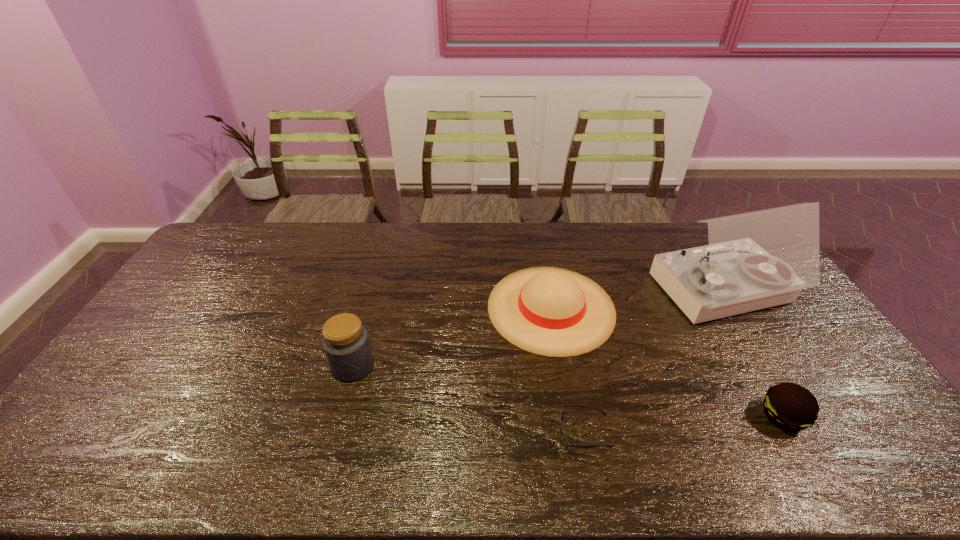
Identify the location of vacant space situated 0.060m on the front-facing side of the shortest object. (535, 431).

I want to click on vacant space situated 0.100m on the front-facing side of the shortest object, so click(518, 431).

Find the location of a particular element. The height and width of the screenshot is (540, 960). free space located 0.160m on the front-facing side of the shortest object is located at coordinates (494, 431).

At what (x,y) coordinates should I click in order to perform the action: click on object positioned at the far edge. Please return your answer as a coordinate pair (x, y). The width and height of the screenshot is (960, 540). Looking at the image, I should click on (760, 259).

Where is `object present at the near edge`? The height and width of the screenshot is (540, 960). object present at the near edge is located at coordinates (565, 442).

This screenshot has height=540, width=960. What are the coordinates of `object that is at the right edge` in the screenshot? It's located at (760, 259).

Where is `object that is at the far right corner`? object that is at the far right corner is located at coordinates (760, 259).

I want to click on free spot at the far edge of the desktop, so click(311, 258).

This screenshot has height=540, width=960. In the image, there is a desktop. In order to click on free space at the near edge in this screenshot , I will do `click(138, 453)`.

Locate an element on the screen. This screenshot has height=540, width=960. vacant space at the left edge is located at coordinates (232, 273).